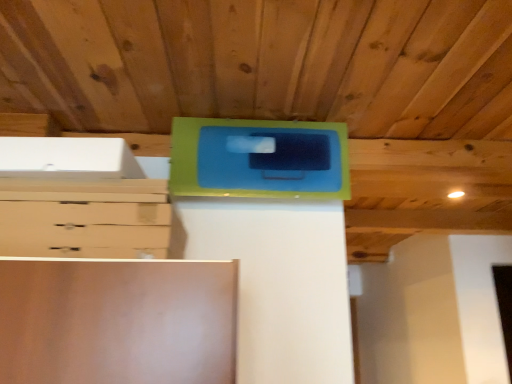
Measure the distance between green matte cabinet at upper center and camera.

A distance of 4.18 feet exists between green matte cabinet at upper center and camera.

The width and height of the screenshot is (512, 384). What do you see at coordinates (259, 158) in the screenshot?
I see `green matte cabinet at upper center` at bounding box center [259, 158].

Where is `green matte cabinet at upper center`? Image resolution: width=512 pixels, height=384 pixels. green matte cabinet at upper center is located at coordinates (259, 158).

Describe the element at coordinates (83, 215) in the screenshot. I see `matte light brown chest of drawers at left` at that location.

The width and height of the screenshot is (512, 384). Find the location of `matte light brown chest of drawers at left`. matte light brown chest of drawers at left is located at coordinates [83, 215].

Locate an element on the screen. green matte cabinet at upper center is located at coordinates (259, 158).

Is matte light brown chest of drawers at left to the left or to the right of green matte cabinet at upper center in the image?

Clearly, matte light brown chest of drawers at left is on the left of green matte cabinet at upper center in the image.

Does matte light brown chest of drawers at left come in front of green matte cabinet at upper center?

Yes, the depth of matte light brown chest of drawers at left is less than that of green matte cabinet at upper center.

Does point (94, 196) come farther from viewer compared to point (270, 130)?

That is False.

From the image's perspective, which object appears higher, matte light brown chest of drawers at left or green matte cabinet at upper center?

green matte cabinet at upper center, from the image's perspective.

Consider the image. From a real-world perspective, is matte light brown chest of drawers at left over green matte cabinet at upper center?

Incorrect, from a real-world perspective, matte light brown chest of drawers at left is lower than green matte cabinet at upper center.

Which object is wider, matte light brown chest of drawers at left or green matte cabinet at upper center?

Wider between the two is matte light brown chest of drawers at left.

Is matte light brown chest of drawers at left taller than green matte cabinet at upper center?

No, matte light brown chest of drawers at left is not taller than green matte cabinet at upper center.

Considering the relative sizes of matte light brown chest of drawers at left and green matte cabinet at upper center in the image provided, is matte light brown chest of drawers at left smaller than green matte cabinet at upper center?

Indeed, matte light brown chest of drawers at left has a smaller size compared to green matte cabinet at upper center.

Is green matte cabinet at upper center inside matte light brown chest of drawers at left?

No, green matte cabinet at upper center is not a part of matte light brown chest of drawers at left.

Looking at this image, would you say matte light brown chest of drawers at left is a long distance from green matte cabinet at upper center?

matte light brown chest of drawers at left is actually quite close to green matte cabinet at upper center.

Is green matte cabinet at upper center at the back of matte light brown chest of drawers at left?

matte light brown chest of drawers at left does not have its back to green matte cabinet at upper center.

How many degrees apart are the facing directions of matte light brown chest of drawers at left and green matte cabinet at upper center?

0.000148 degrees.

The image size is (512, 384). Identify the location of chest of drawers in front of the green matte cabinet at upper center. (83, 215).

Between green matte cabinet at upper center and matte light brown chest of drawers at left, which one appears on the left side from the viewer's perspective?

From the viewer's perspective, matte light brown chest of drawers at left appears more on the left side.

Is green matte cabinet at upper center behind matte light brown chest of drawers at left?

Result: Yes, it is.

Between point (285, 149) and point (138, 187), which one is positioned in front?

The point (138, 187) is closer.

In the scene shown: From the image's perspective, which is below, green matte cabinet at upper center or matte light brown chest of drawers at left?

matte light brown chest of drawers at left, from the image's perspective.

From a real-world perspective, does green matte cabinet at upper center stand above matte light brown chest of drawers at left?

Correct, in the physical world, green matte cabinet at upper center is higher than matte light brown chest of drawers at left.

Is green matte cabinet at upper center wider than matte light brown chest of drawers at left?

Incorrect, the width of green matte cabinet at upper center does not surpass that of matte light brown chest of drawers at left.

Which of these two, green matte cabinet at upper center or matte light brown chest of drawers at left, stands taller?

With more height is green matte cabinet at upper center.

Does green matte cabinet at upper center have a larger size compared to matte light brown chest of drawers at left?

Indeed, green matte cabinet at upper center has a larger size compared to matte light brown chest of drawers at left.

Choose the correct answer: Is green matte cabinet at upper center inside matte light brown chest of drawers at left or outside it?

green matte cabinet at upper center is spatially situated outside matte light brown chest of drawers at left.

Is there a large distance between green matte cabinet at upper center and matte light brown chest of drawers at left?

No, green matte cabinet at upper center is not far from matte light brown chest of drawers at left.

Could you tell me if green matte cabinet at upper center is turned towards matte light brown chest of drawers at left?

No, green matte cabinet at upper center is not oriented towards matte light brown chest of drawers at left.

How different are the orientations of green matte cabinet at upper center and matte light brown chest of drawers at left in degrees?

green matte cabinet at upper center and matte light brown chest of drawers at left are facing 0.000148 degrees away from each other.

How much distance is there between green matte cabinet at upper center and matte light brown chest of drawers at left?

green matte cabinet at upper center and matte light brown chest of drawers at left are 36.46 centimeters apart from each other.

The image size is (512, 384). In order to click on cabinetry above the matte light brown chest of drawers at left (from a real-world perspective) in this screenshot , I will do `click(259, 158)`.

Locate an element on the screen. cabinetry above the matte light brown chest of drawers at left (from a real-world perspective) is located at coordinates (259, 158).

I want to click on cabinetry above the matte light brown chest of drawers at left (from the image's perspective), so click(259, 158).